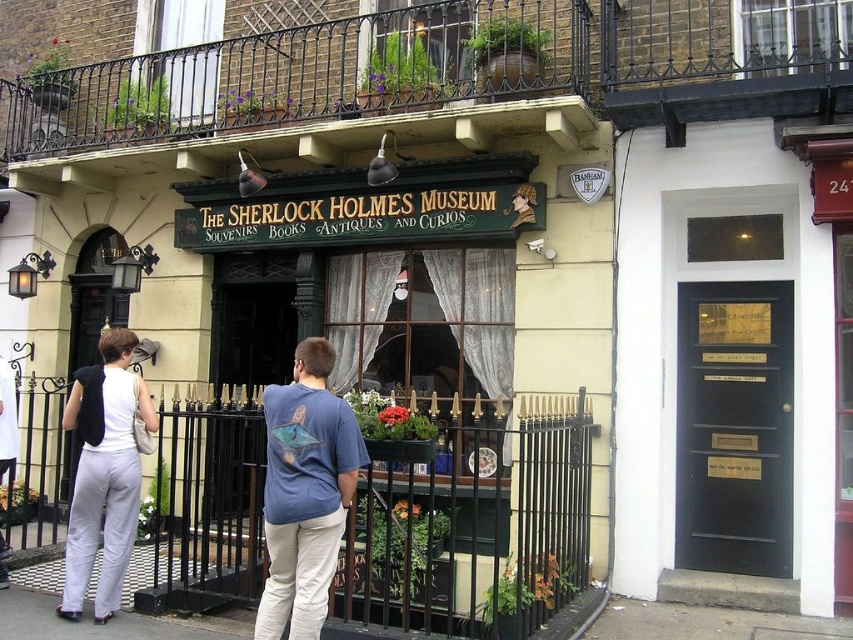
Question: Can you confirm if black matte door at center is bigger than blue cotton t-shirt at center?

Choices:
 (A) yes
 (B) no

Answer: (A)

Question: Considering the relative positions of white cotton pants at center and white matte vest at center in the image provided, where is white cotton pants at center located with respect to white matte vest at center?

Choices:
 (A) above
 (B) below

Answer: (A)

Question: Does black matte door at center have a greater width compared to blue cotton t-shirt at center?

Choices:
 (A) no
 (B) yes

Answer: (B)

Question: Which point is farther to the camera?

Choices:
 (A) blue cotton t-shirt at center
 (B) white cotton pants at center
 (C) white matte vest at center
 (D) black matte door at center

Answer: (D)

Question: Which of these objects is positioned closest to the white matte vest at center?

Choices:
 (A) black matte door at center
 (B) blue cotton t-shirt at center

Answer: (B)

Question: Estimate the real-world distances between objects in this image. Which object is farther from the white cotton pants at center?

Choices:
 (A) white matte vest at center
 (B) blue cotton t-shirt at center
 (C) black matte door at center

Answer: (C)